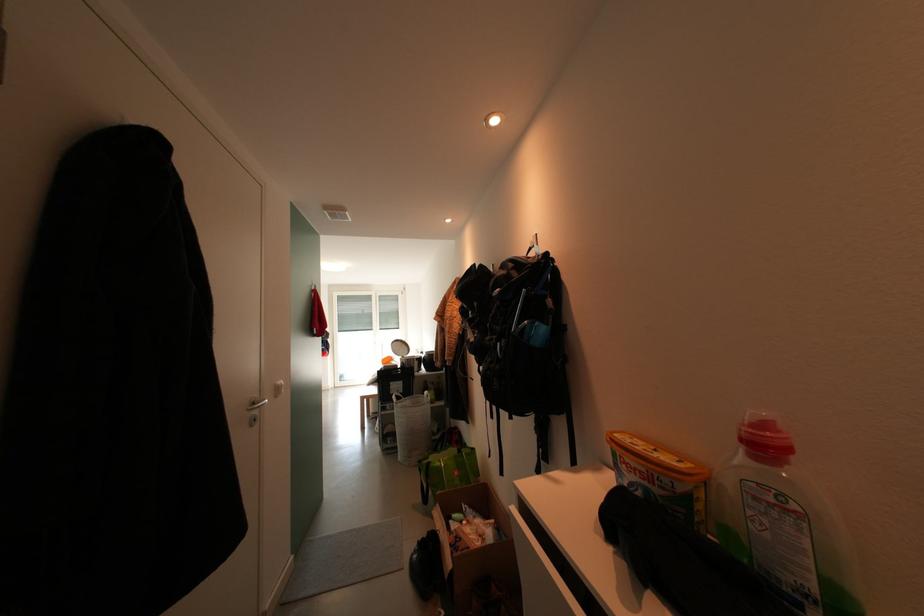
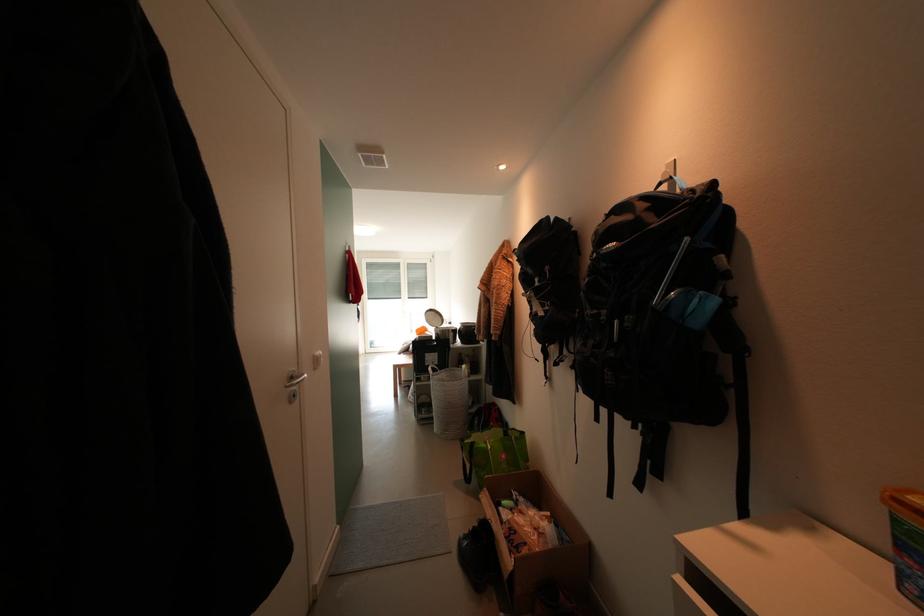
Question: The first image is from the beginning of the video and the second image is from the end. How did the camera likely rotate when shooting the video?

Choices:
 (A) Left
 (B) Right
 (C) Up
 (D) Down

Answer: (D)